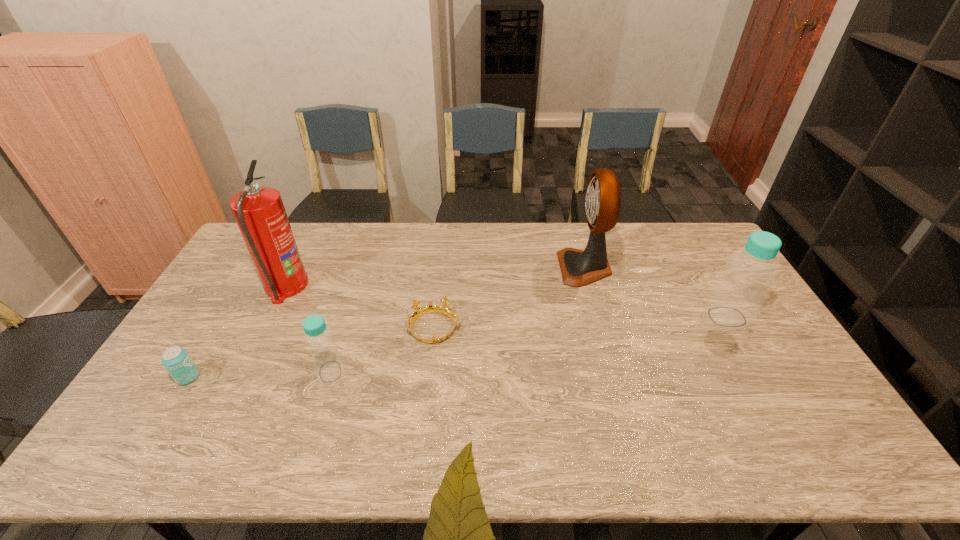
This screenshot has height=540, width=960. In order to click on free space in the image that satisfies the following two spatial constraints: 1. on the instruction side of the second object from left to right; 2. on the right side of the third object from right to left in this screenshot , I will do `click(265, 328)`.

Image resolution: width=960 pixels, height=540 pixels. What are the coordinates of `free location that satisfies the following two spatial constraints: 1. on the back side of the left bottle; 2. on the right side of the third tallest object` in the screenshot? It's located at (348, 317).

Identify the location of vacant space that satisfies the following two spatial constraints: 1. on the front-facing side of the second object from right to left; 2. on the front side of the beer can. coord(615,377).

Where is `free spot that satisfies the following two spatial constraints: 1. on the instruction side of the rightmost object; 2. on the left side of the fifth object from right to left`? free spot that satisfies the following two spatial constraints: 1. on the instruction side of the rightmost object; 2. on the left side of the fifth object from right to left is located at coordinates (271, 317).

The height and width of the screenshot is (540, 960). In order to click on vacant region that satisfies the following two spatial constraints: 1. on the instruction side of the fire extinguisher; 2. on the left side of the shortest object in this screenshot , I will do `click(265, 328)`.